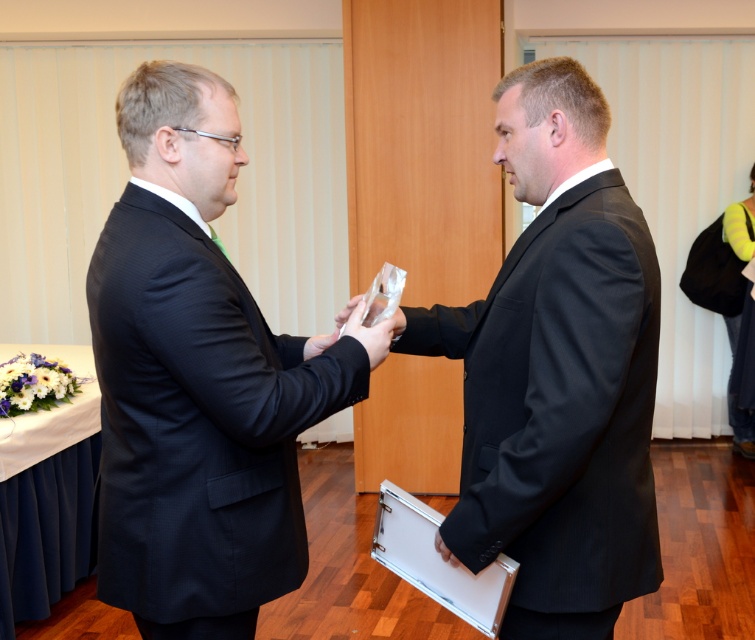
Looking at this image, you are a photographer standing behind the table draped with a beige cloth on the left. You want to take a photo of both the matte black suit at left and the black pinstripe suit at center so that both are fully visible. Which person should you position closer to the camera to ensure their full height is captured without cropping?

You should position the matte black suit at left closer to the camera because it has a lesser height compared to the black pinstripe suit at center, ensuring both are fully visible in the photo.

You are an event photographer who needs to capture a photo of the black pinstripe suit at center and the translucent plastic hand at center. Since you want to ensure both are in focus, you need to know which one is taller. Can you determine which object is taller?

The black pinstripe suit at center is taller than the translucent plastic hand at center according to the description.